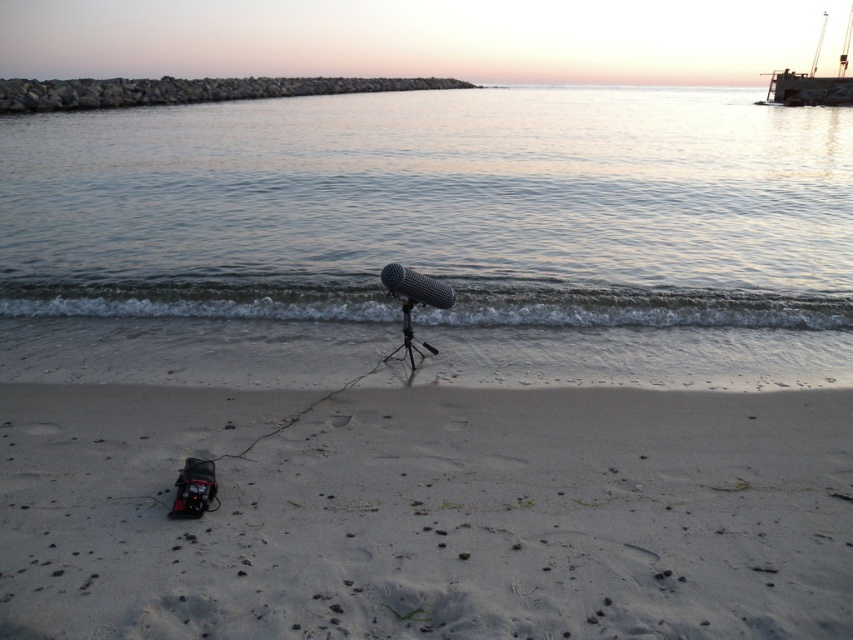
Based on the photo, is metallic gray boat at upper right shorter than black matte tripod at center?

Incorrect, metallic gray boat at upper right's height does not fall short of black matte tripod at center's.

Is metallic gray boat at upper right wider than black matte tripod at center?

Yes.

What do you see at coordinates (811, 80) in the screenshot?
I see `metallic gray boat at upper right` at bounding box center [811, 80].

At what (x,y) coordinates should I click in order to perform the action: click on metallic gray boat at upper right. Please return your answer as a coordinate pair (x, y). Image resolution: width=853 pixels, height=640 pixels. Looking at the image, I should click on (811, 80).

Which is in front, point (483, 125) or point (399, 348)?

Point (399, 348) is in front.

The width and height of the screenshot is (853, 640). What do you see at coordinates (431, 236) in the screenshot?
I see `clear water at center` at bounding box center [431, 236].

Locate an element on the screen. Image resolution: width=853 pixels, height=640 pixels. clear water at center is located at coordinates coord(431,236).

Who is taller, white sandy beach at lower center or black matte tripod at center?

white sandy beach at lower center is taller.

Is the position of white sandy beach at lower center more distant than that of black matte tripod at center?

No, white sandy beach at lower center is closer to the viewer.

Find the location of a particular element. The width and height of the screenshot is (853, 640). white sandy beach at lower center is located at coordinates (427, 515).

This screenshot has height=640, width=853. Find the location of `white sandy beach at lower center`. white sandy beach at lower center is located at coordinates (427, 515).